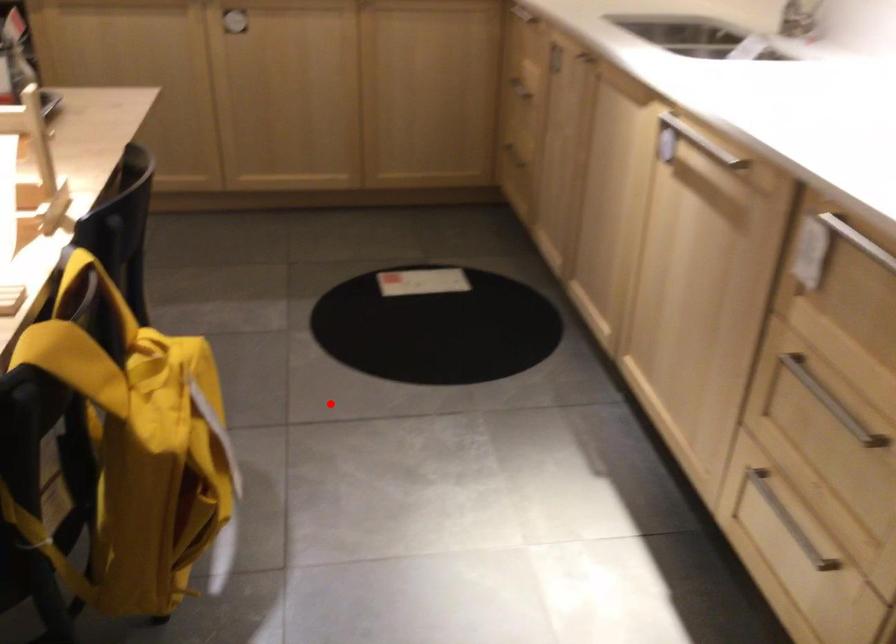
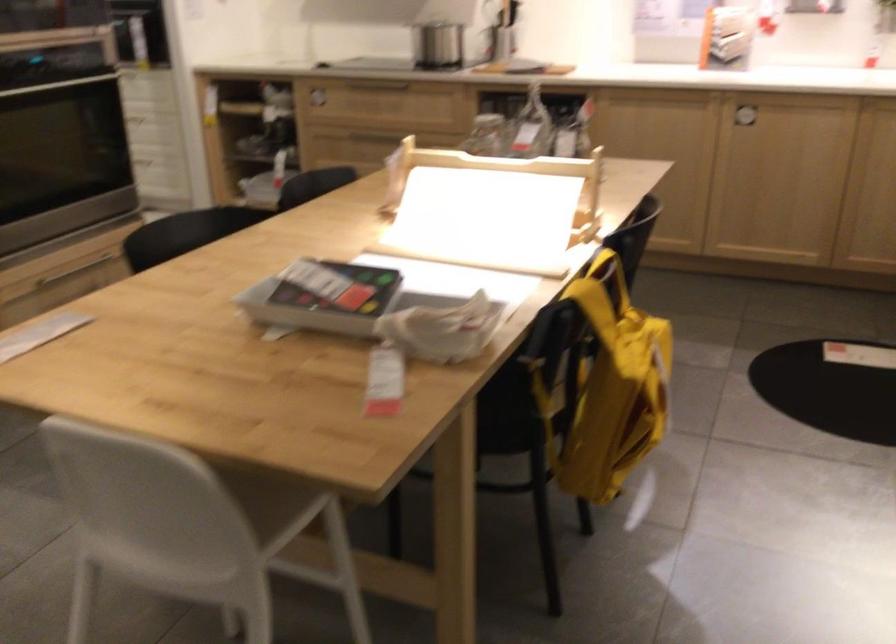
Where in the second image is the point corresponding to the highlighted location from the first image?

(760, 419)